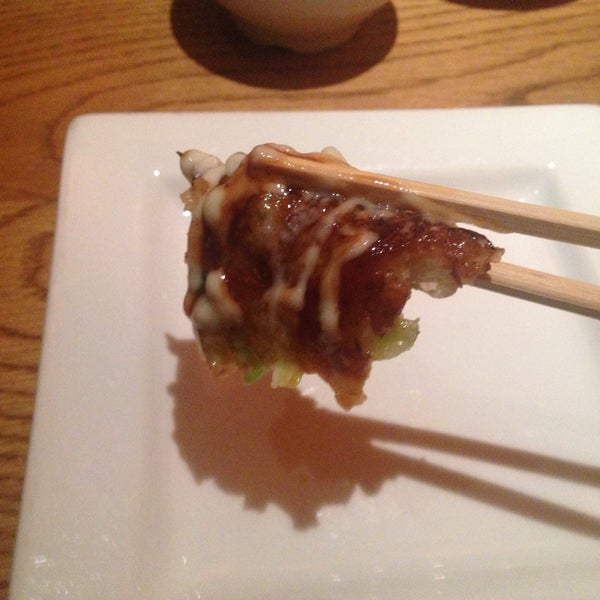
You are a GUI agent. You are given a task and a screenshot of the screen. Output one action in this format:
    pyautogui.click(x=<x>, y=<y>)
    Task: Click on the white square plate
    
    Given the screenshot: What is the action you would take?
    pyautogui.click(x=244, y=560)